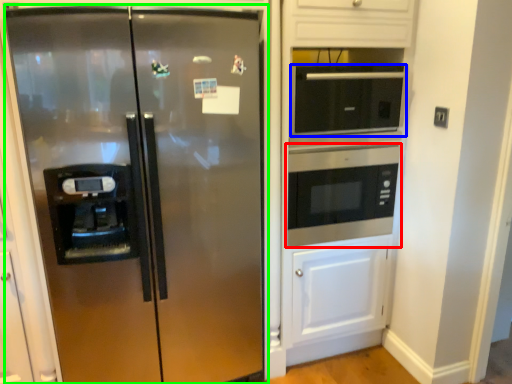
Question: Based on their relative distances, which object is farther from microwave oven (highlighted by a red box)? Choose from microwave oven (highlighted by a blue box) and refrigerator (highlighted by a green box).

Choices:
 (A) microwave oven
 (B) refrigerator

Answer: (B)